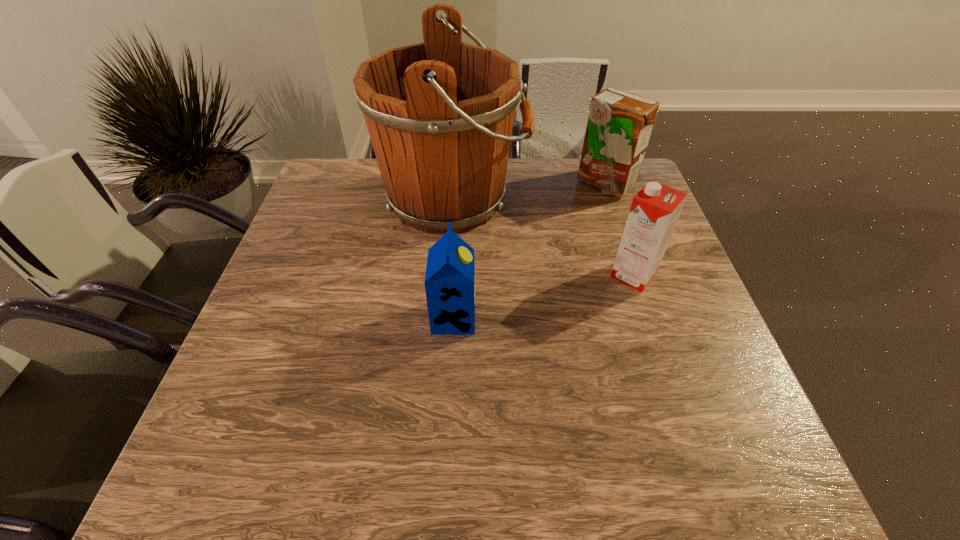
The image size is (960, 540). I want to click on carton situated at the far edge, so click(619, 126).

Locate an element on the screen. Image resolution: width=960 pixels, height=540 pixels. object located at the far right corner is located at coordinates (619, 126).

Identify the location of vacant area at the far edge of the desktop. (585, 188).

In the image, there is a desktop. Identify the location of vacant space at the near edge. (440, 450).

Identify the location of vacant point at the left edge. Image resolution: width=960 pixels, height=540 pixels. (261, 342).

The height and width of the screenshot is (540, 960). In the image, there is a desktop. Find the location of `blank space at the far left corner`. blank space at the far left corner is located at coordinates (346, 203).

The height and width of the screenshot is (540, 960). I want to click on vacant area at the near left corner of the desktop, so click(x=243, y=480).

The width and height of the screenshot is (960, 540). I want to click on free space at the near right corner of the desktop, so click(697, 493).

At what (x,y) coordinates should I click in order to perform the action: click on free space between the leftmost carton and the second nearest carton. Please return your answer as a coordinate pair (x, y). The width and height of the screenshot is (960, 540). Looking at the image, I should click on (543, 296).

Identify the location of free space between the tallest object and the farthest carton. (529, 191).